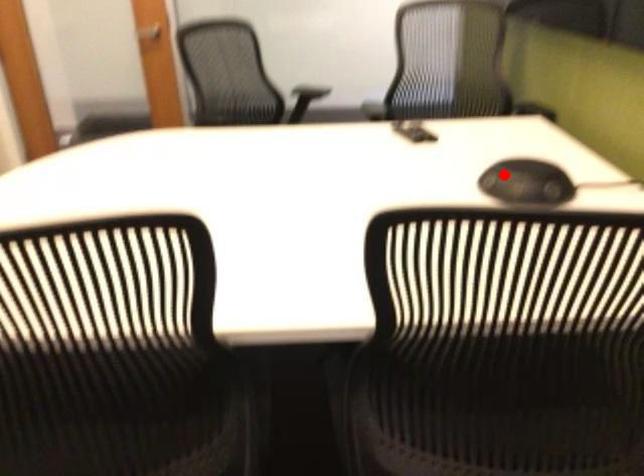
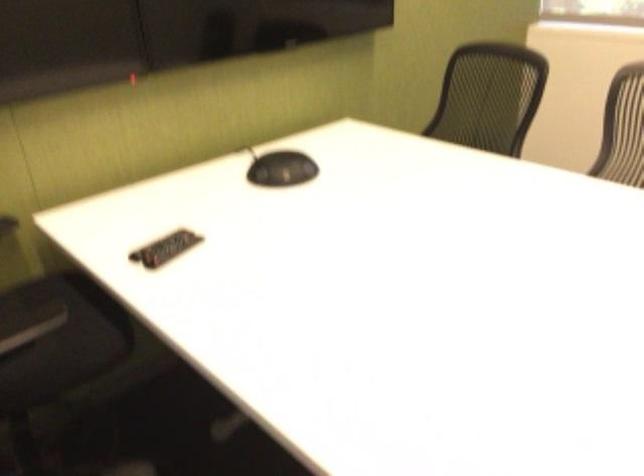
Question: I am providing you with two images of the same scene from different viewpoints. Given a red point in image1, look at the same physical point in image2. Is it:

Choices:
 (A) Closer to the viewpoint
 (B) Farther from the viewpoint

Answer: (B)